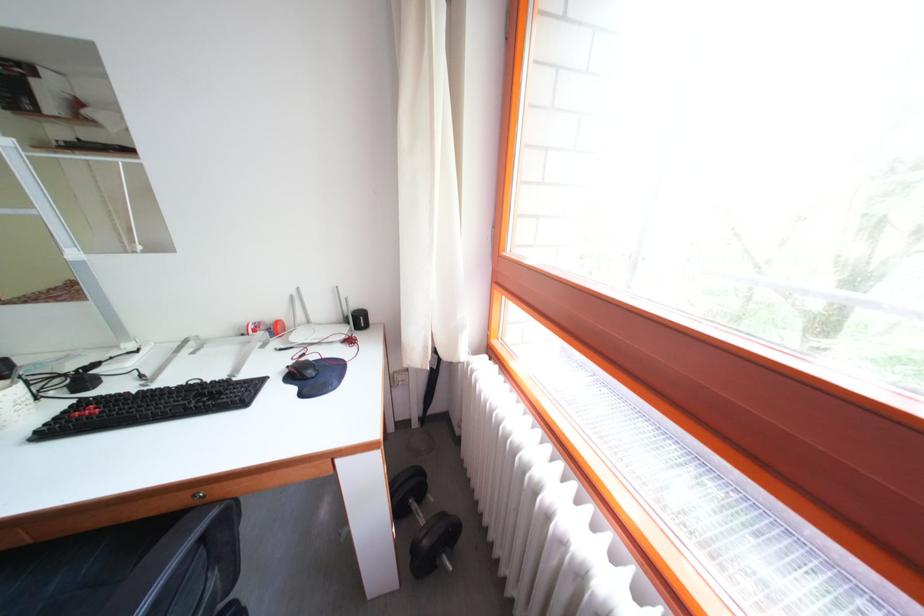
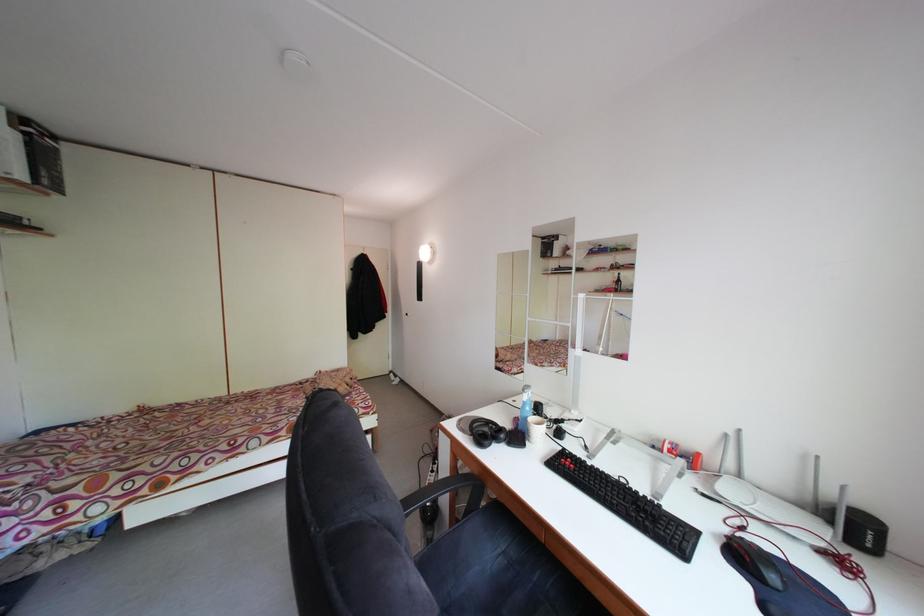
Find the pixel in the second image that matches (368,326) in the first image.

(865, 535)